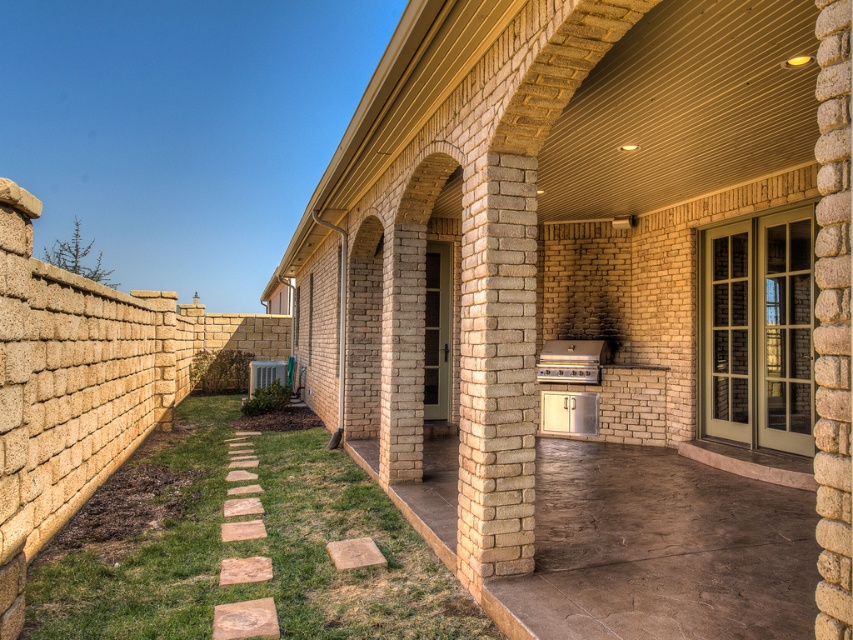
Does point (590, 355) lie in front of point (555, 397)?

Yes.

Locate an element on the screen. Image resolution: width=853 pixels, height=640 pixels. matte stainless steel grill at center is located at coordinates (572, 360).

Is point (412, 164) farther from camera compared to point (543, 365)?

No, (412, 164) is closer to viewer.

From the picture: Can you confirm if matte brick grill at center is smaller than matte stainless steel grill at center?

Incorrect, matte brick grill at center is not smaller in size than matte stainless steel grill at center.

What do you see at coordinates (582, 243) in the screenshot? The image size is (853, 640). I see `matte brick grill at center` at bounding box center [582, 243].

The height and width of the screenshot is (640, 853). Identify the location of matte brick grill at center. (582, 243).

What do you see at coordinates (582, 243) in the screenshot? The image size is (853, 640). I see `matte brick grill at center` at bounding box center [582, 243].

Who is more distant from viewer, (579, 188) or (595, 433)?

The point (595, 433) is more distant.

Find the location of a particular element. This screenshot has height=640, width=853. matte brick grill at center is located at coordinates (582, 243).